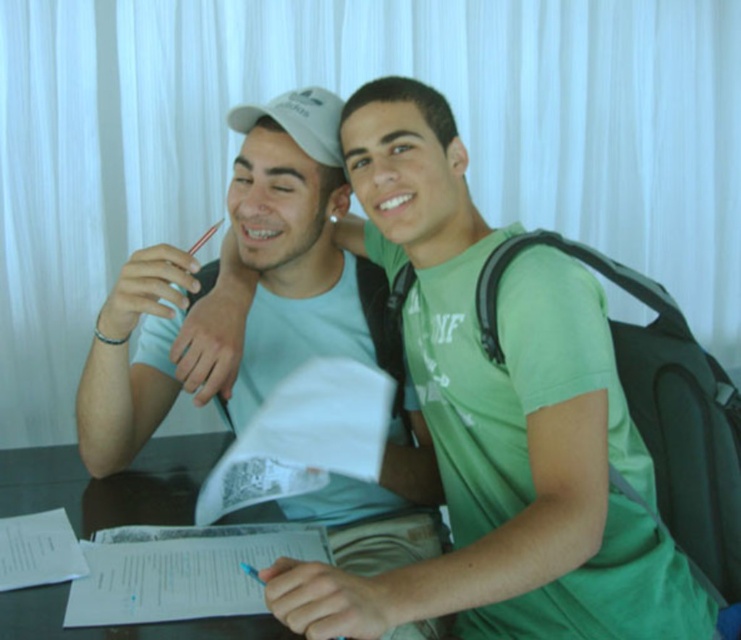
You are standing in front of the table where the two people are sitting. You notice two points marked on the table surface. The first point is at coordinate point (276,257) and the second point is at coordinate point (227,516). Which point is closer to you?

Point (276,257) is closer to you because it is further to the viewer than point (227,516).

You are a photographer trying to capture a candid shot of the two people at the table. You notice the matte white cap at upper left and the transparent glass table at center. Which object is taller in the scene?

The matte white cap at upper left is taller than the transparent glass table at center.